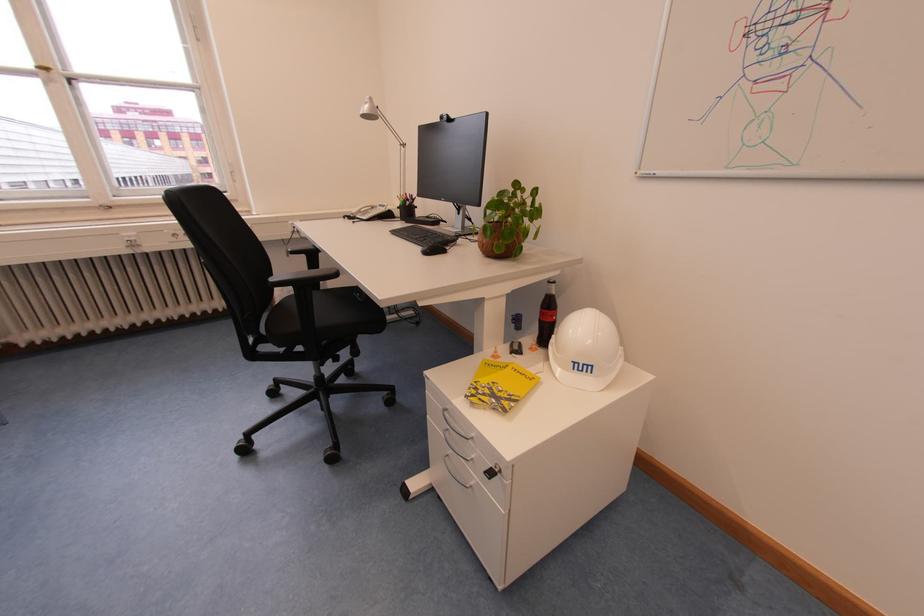
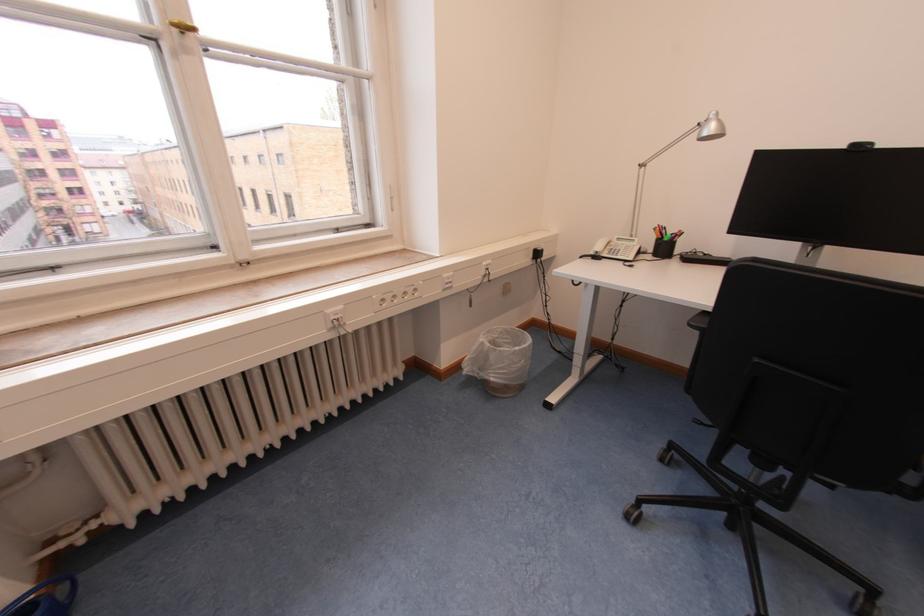
Where in the second image is the point corresponding to (x=412, y=197) from the first image?

(665, 228)